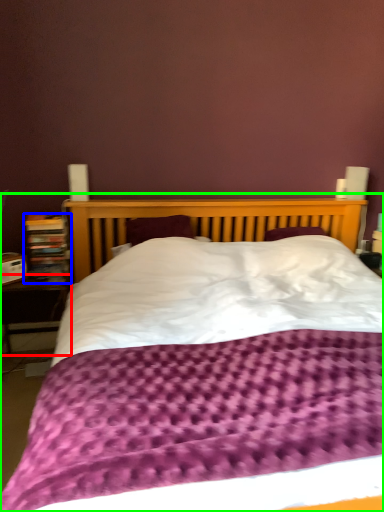
Question: Estimate the real-world distances between objects in this image. Which object is closer to table (highlighted by a red box), bookcase (highlighted by a blue box) or bed (highlighted by a green box)?

Choices:
 (A) bookcase
 (B) bed

Answer: (A)